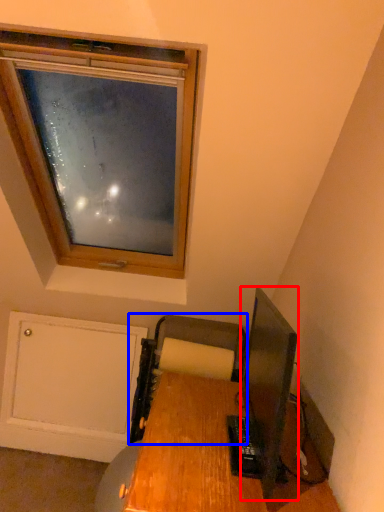
Question: Which of the following is the farthest to the observer, television (highlighted by a red box) or printer (highlighted by a blue box)?

Choices:
 (A) television
 (B) printer

Answer: (B)